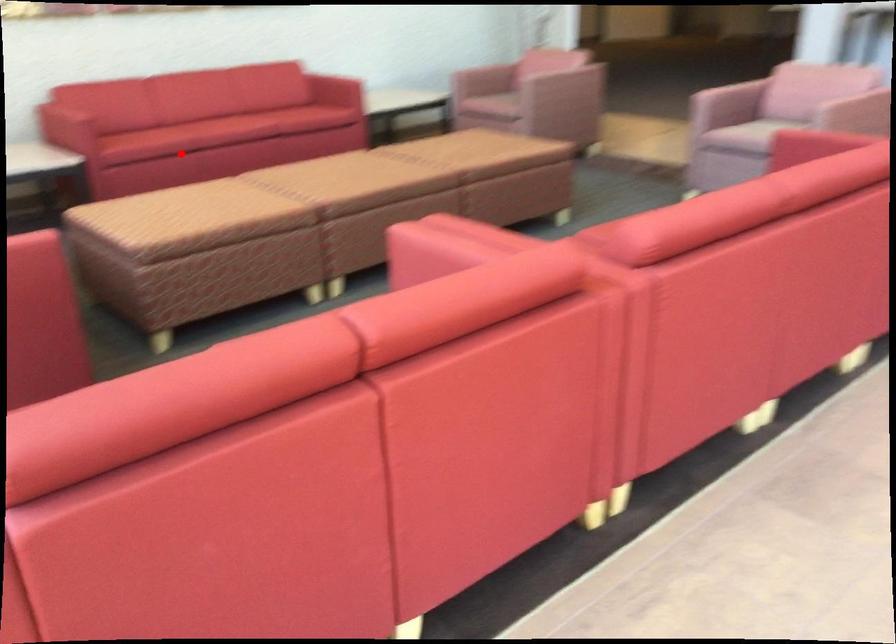
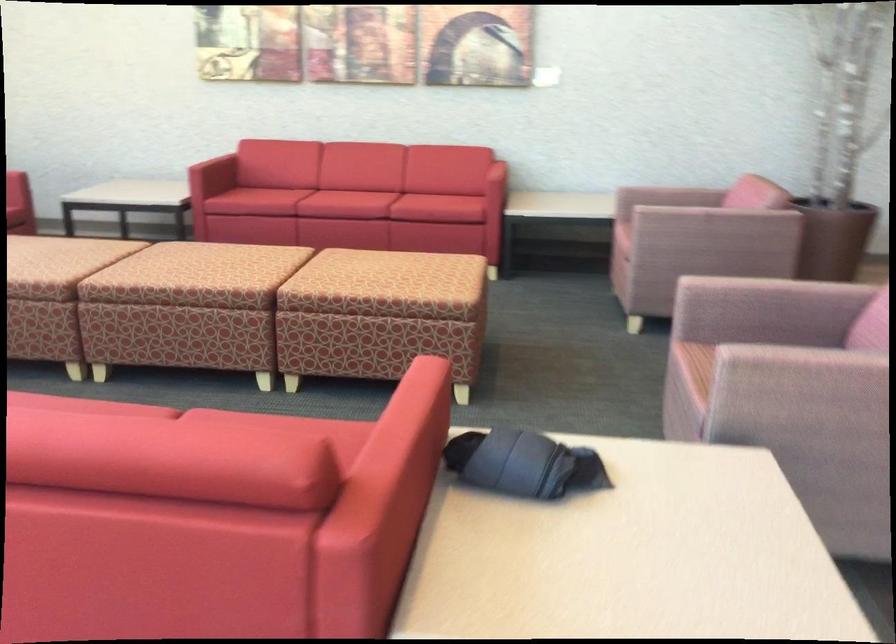
In the second image, find the point that corresponds to the highlighted location in the first image.

(265, 200)